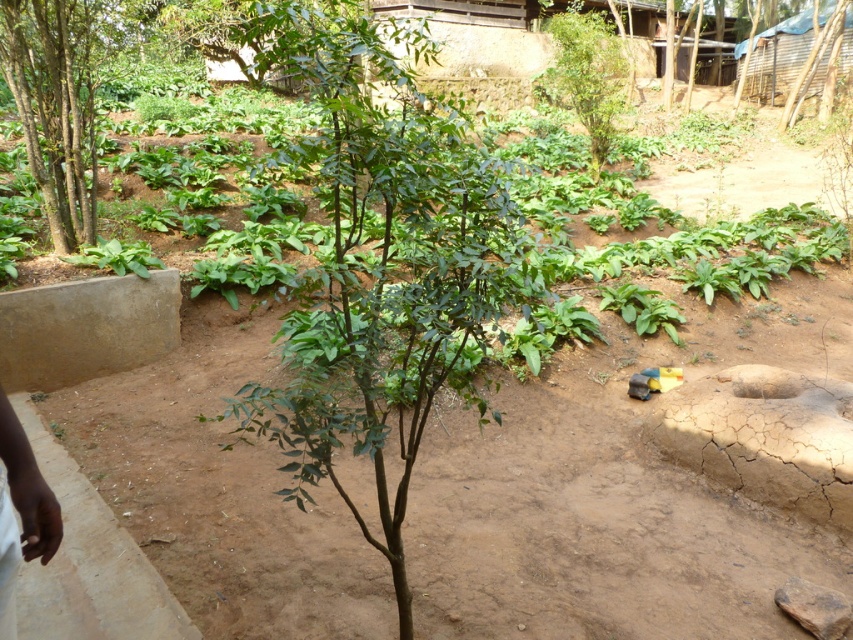
Does green leafy tree at left appear under green leafy tree at upper center?

Indeed, green leafy tree at left is positioned under green leafy tree at upper center.

Between point (67, 148) and point (581, 100), which one is positioned behind?

Point (581, 100)

Who is more forward, (42, 120) or (585, 124)?

Positioned in front is point (42, 120).

Locate an element on the screen. green leafy tree at left is located at coordinates (55, 106).

Does green leafy tree at center appear on the right side of green leafy tree at left?

Yes, green leafy tree at center is to the right of green leafy tree at left.

Is green leafy tree at center closer to camera compared to green leafy tree at left?

No, green leafy tree at center is further to the viewer.

Which is behind, point (322, 51) or point (90, 92)?

The point (90, 92) is behind.

Locate an element on the screen. The image size is (853, 640). green leafy tree at center is located at coordinates (383, 266).

Can you confirm if green leafy tree at center is thinner than green leafy tree at upper center?

Correct, green leafy tree at center's width is less than green leafy tree at upper center's.

You are a GUI agent. You are given a task and a screenshot of the screen. Output one action in this format:
    pyautogui.click(x=<x>, y=<y>)
    Task: Click on the green leafy tree at center
    The width and height of the screenshot is (853, 640).
    Given the screenshot: What is the action you would take?
    pyautogui.click(x=383, y=266)